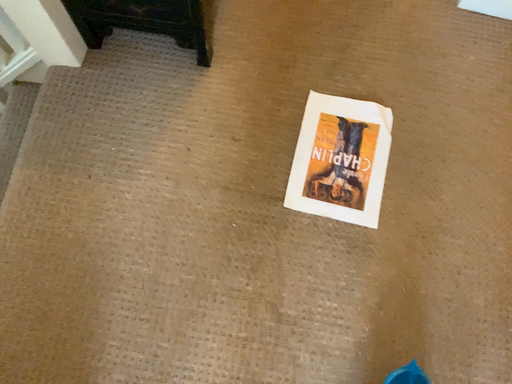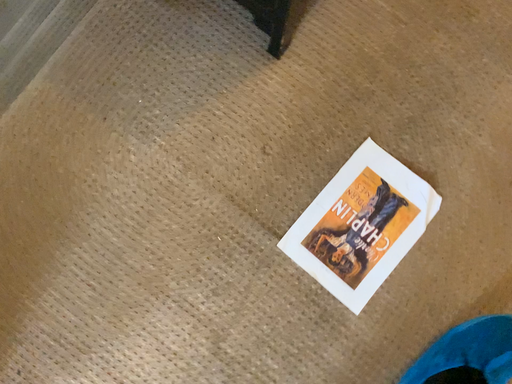
Question: Which way did the camera rotate in the video?

Choices:
 (A) rotated right
 (B) rotated left

Answer: (B)